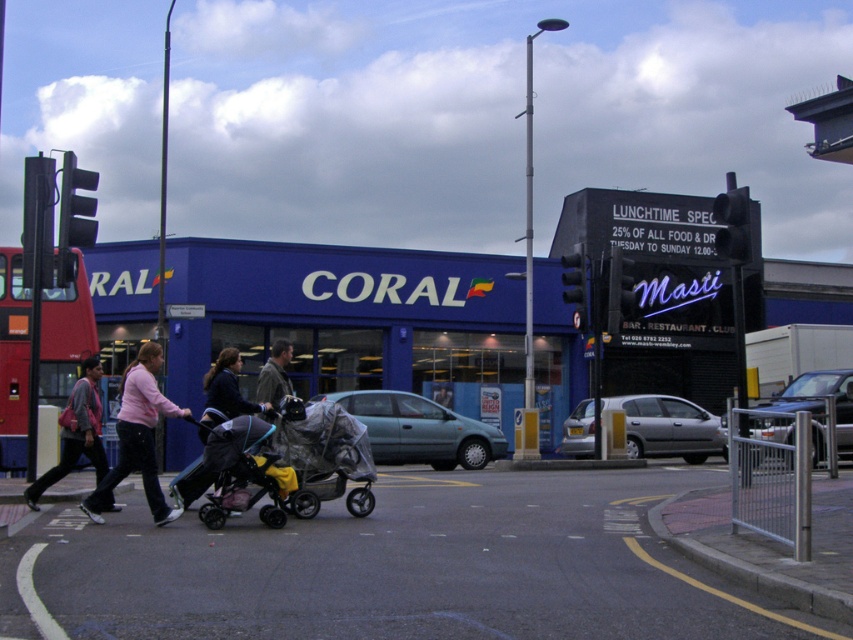
Question: Which point is farther to the camera?

Choices:
 (A) (418, 413)
 (B) (723, 440)

Answer: (B)

Question: Does metallic blue hatchback at center have a greater width compared to metallic blue sedan at center?

Choices:
 (A) yes
 (B) no

Answer: (B)

Question: Is dark gray fabric stroller at center-left below brown leather jacket at center?

Choices:
 (A) yes
 (B) no

Answer: (A)

Question: Among these objects, which one is nearest to the camera?

Choices:
 (A) blue matte store at center
 (B) silver metallic hatchback at center
 (C) matte pink jacket at center
 (D) red metallic bus at left

Answer: (C)

Question: Which object appears closest to the camera in this image?

Choices:
 (A) blue matte store at center
 (B) matte pink sweater at center

Answer: (B)

Question: From the image, what is the correct spatial relationship of silver metallic hatchback at center in relation to brown leather jacket at center?

Choices:
 (A) left
 (B) right

Answer: (B)